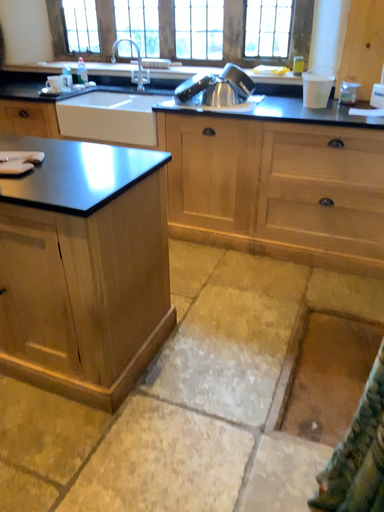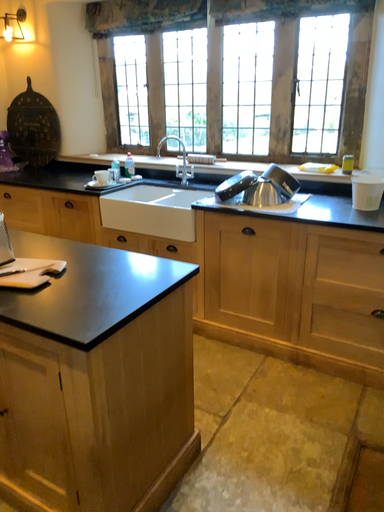
Question: Which way did the camera rotate in the video?

Choices:
 (A) rotated left
 (B) rotated right

Answer: (A)